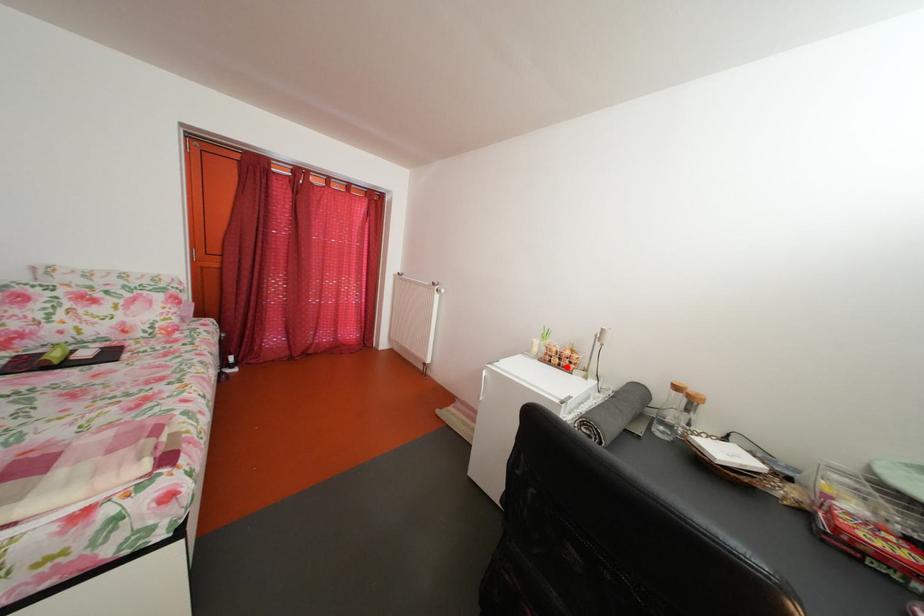
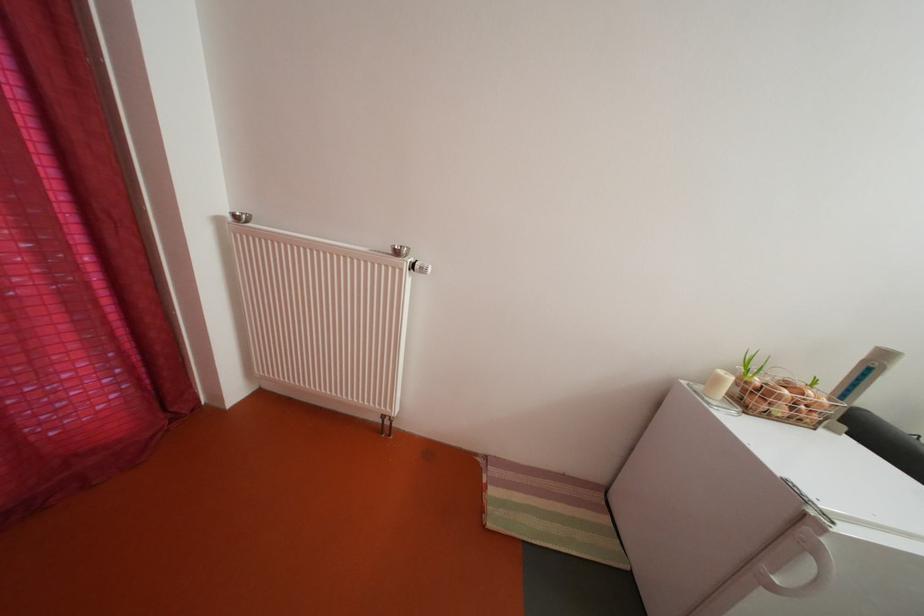
Question: I am providing you with two images of the same scene from different viewpoints. A red point is marked on the first image. At the location where the point appears in image 1, is it still visible in image 2?

Choices:
 (A) Yes
 (B) No

Answer: (A)